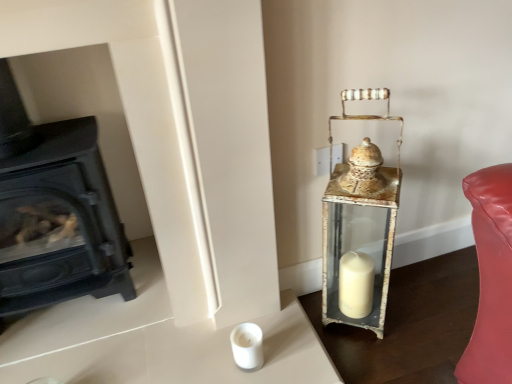
You are a GUI agent. You are given a task and a screenshot of the screen. Output one action in this format:
    pyautogui.click(x=<x>, y=<y>)
    Task: Click on the free location to the right of antique brass lantern at right
    Image resolution: width=512 pixels, height=384 pixels.
    Given the screenshot: What is the action you would take?
    pyautogui.click(x=419, y=312)